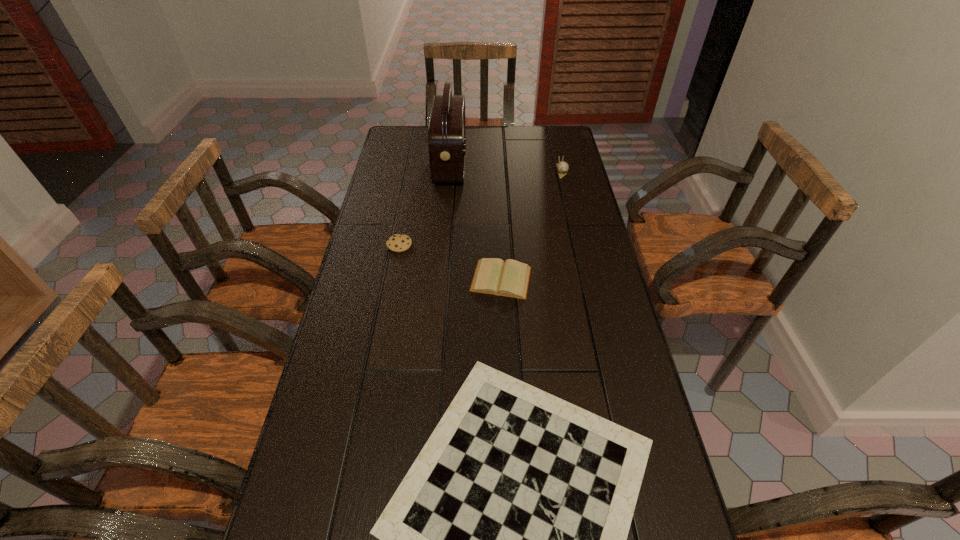
Find the location of `free space between the escargot and the diary`. free space between the escargot and the diary is located at coordinates pos(531,225).

The image size is (960, 540). I want to click on vacant region between the third farthest object and the tallest object, so click(425, 205).

This screenshot has width=960, height=540. In order to click on free space between the escargot and the radio receiver in this screenshot , I will do `click(506, 168)`.

You are a GUI agent. You are given a task and a screenshot of the screen. Output one action in this format:
    pyautogui.click(x=<x>, y=<y>)
    Task: Click on the object that is the closest one to the fourth farthest object
    
    Given the screenshot: What is the action you would take?
    pyautogui.click(x=398, y=242)

This screenshot has height=540, width=960. In order to click on object that is the fourth closest to the tallest object in this screenshot , I will do `click(507, 539)`.

Locate an element on the screen. free space that satisfies the following two spatial constraints: 1. on the front side of the leftmost object; 2. on the left side of the diary is located at coordinates (393, 279).